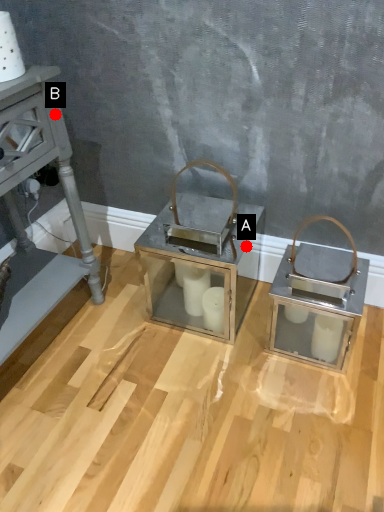
Question: Two points are circled on the image, labeled by A and B beside each circle. Which of the following is the farthest from the observer?

Choices:
 (A) A is further
 (B) B is further

Answer: (A)